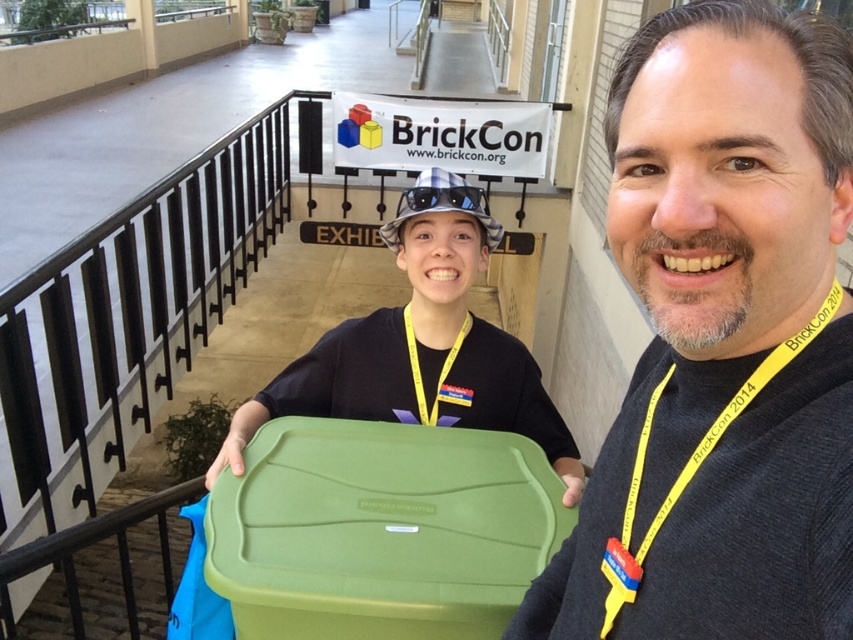
You are organizing a BrickCon event and need to place the matte black shirt at center and the green plastic bin at center in a display. Which item should you place first if you want to ensure both fit in the available space without overlapping?

You should place the green plastic bin at center first because the matte black shirt at center occupies less space, so placing the larger item first ensures both fit without overlapping.